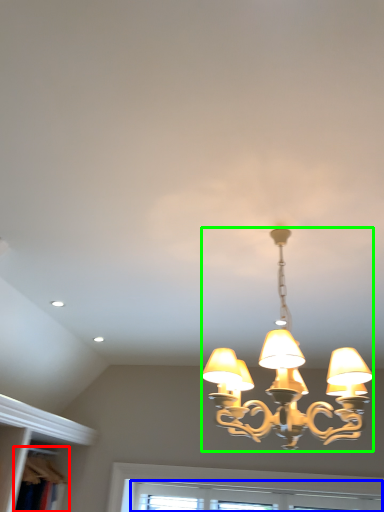
Question: Which is farther away from bookshelf (highlighted by a red box)? window (highlighted by a blue box) or lamp (highlighted by a green box)?

Choices:
 (A) window
 (B) lamp

Answer: (B)